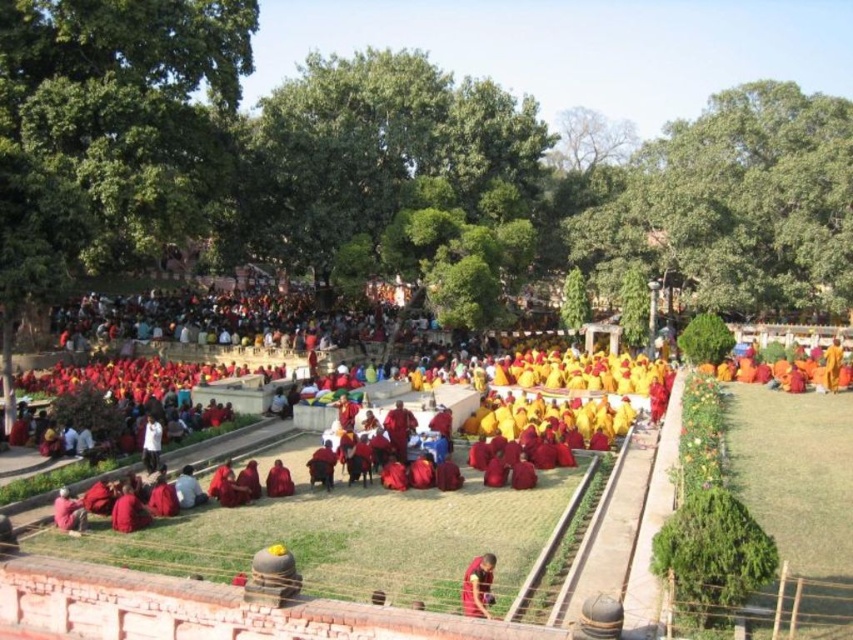
Question: Which point is closer to the camera?

Choices:
 (A) (57, 525)
 (B) (619, 435)
 (C) (280, 492)

Answer: (A)

Question: Does red cotton robes at center come behind red velvet robe at center?

Choices:
 (A) no
 (B) yes

Answer: (A)

Question: Which point is closer to the camera?

Choices:
 (A) (271, 468)
 (B) (68, 529)
 (C) (395, 532)
 (D) (483, 600)

Answer: (D)

Question: Which is nearer to the red velvet robe at lower left?

Choices:
 (A) red cotton robes at center
 (B) red velvet robe at center

Answer: (B)

Question: Does red cotton robes at center lie in front of red velvet monk at center?

Choices:
 (A) no
 (B) yes

Answer: (B)

Question: Where is red velvet monk at center located in relation to red velvet robe at lower left in the image?

Choices:
 (A) right
 (B) left

Answer: (A)